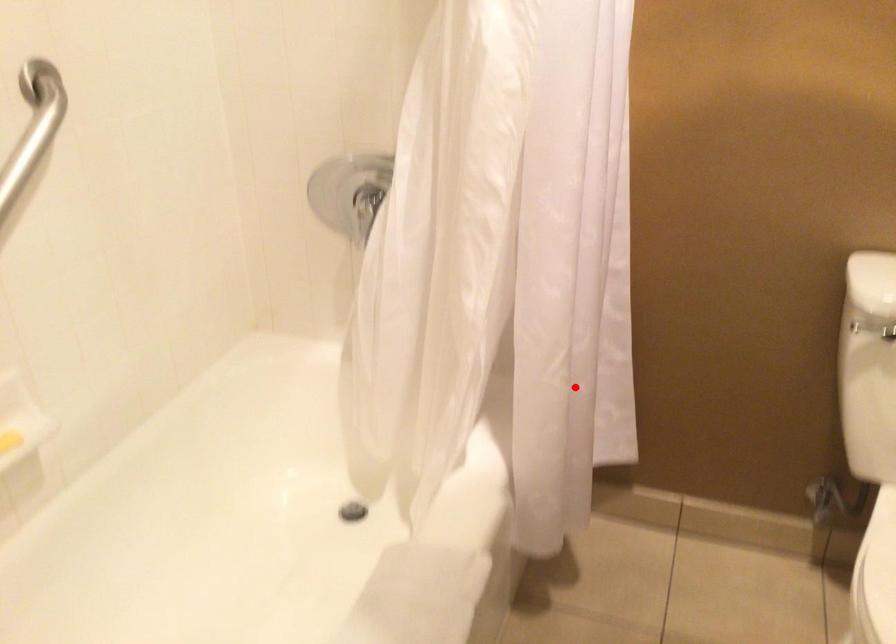
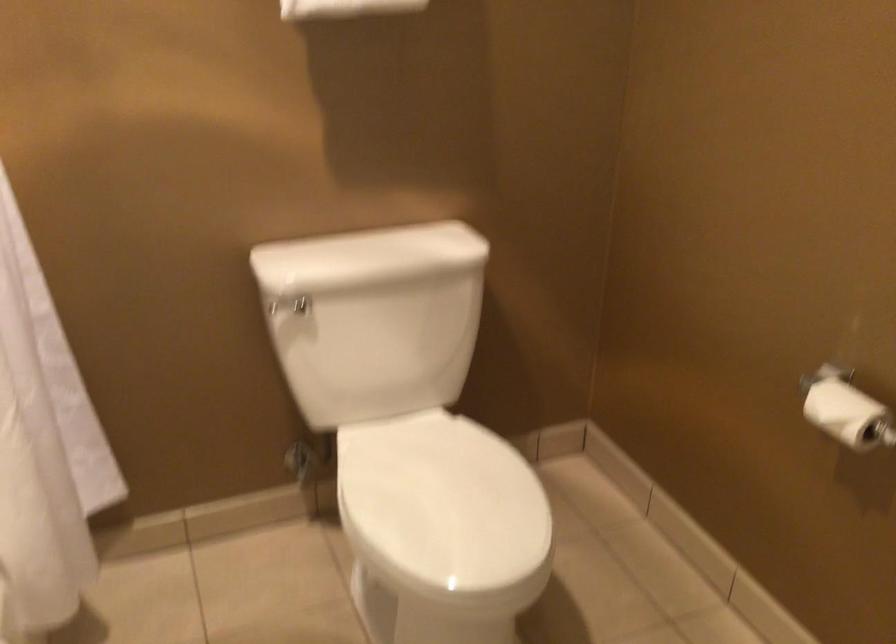
Find the pixel in the second image that matches the highlighted location in the first image.

(44, 444)